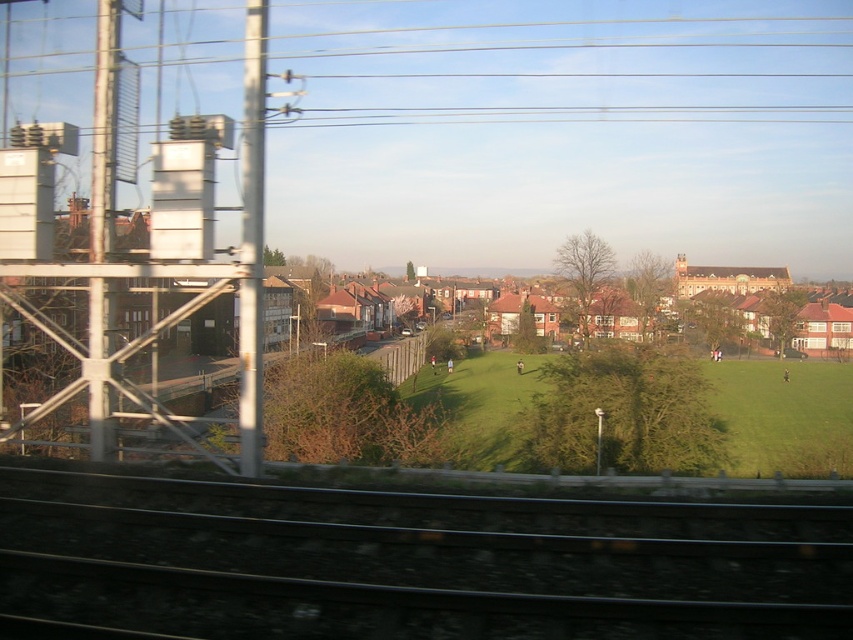
Question: Is black metal track at bottom thinner than green grass field at center?

Choices:
 (A) yes
 (B) no

Answer: (A)

Question: Is the position of black metal track at bottom more distant than that of green grass field at center?

Choices:
 (A) yes
 (B) no

Answer: (B)

Question: Is black metal track at bottom closer to camera compared to green grass field at center?

Choices:
 (A) no
 (B) yes

Answer: (B)